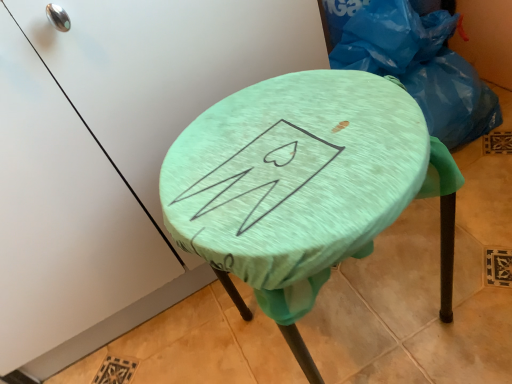
Question: Does point (308, 297) appear closer or farther from the camera than point (444, 84)?

Choices:
 (A) farther
 (B) closer

Answer: (B)

Question: Considering the positions of mint fabric-covered stool at center and blue plastic bag at upper right in the image, is mint fabric-covered stool at center taller or shorter than blue plastic bag at upper right?

Choices:
 (A) tall
 (B) short

Answer: (A)

Question: From the image's perspective, is mint fabric-covered stool at center located above or below blue plastic bag at upper right?

Choices:
 (A) above
 (B) below

Answer: (B)

Question: Is blue plastic bag at upper right taller or shorter than mint fabric-covered stool at center?

Choices:
 (A) short
 (B) tall

Answer: (A)

Question: In the image, is blue plastic bag at upper right positioned in front of or behind mint fabric-covered stool at center?

Choices:
 (A) behind
 (B) front

Answer: (A)

Question: Is blue plastic bag at upper right bigger or smaller than mint fabric-covered stool at center?

Choices:
 (A) big
 (B) small

Answer: (B)

Question: From the image's perspective, relative to mint fabric-covered stool at center, is blue plastic bag at upper right above or below?

Choices:
 (A) above
 (B) below

Answer: (A)